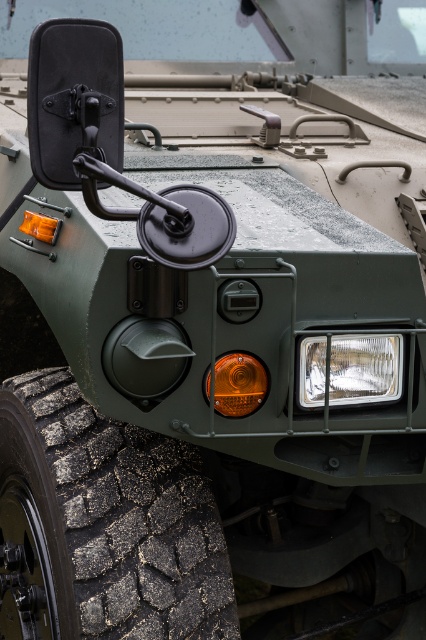
Question: Among these objects, which one is nearest to the camera?

Choices:
 (A) black rubber tire at lower left
 (B) clear plastic headlight at lower right

Answer: (B)

Question: Does black rubber tire at lower left appear over clear plastic headlight at lower right?

Choices:
 (A) no
 (B) yes

Answer: (A)

Question: Among these objects, which one is nearest to the camera?

Choices:
 (A) black rubber tire at lower left
 (B) clear plastic headlight at lower right

Answer: (B)

Question: Does black rubber tire at lower left appear over clear plastic headlight at lower right?

Choices:
 (A) yes
 (B) no

Answer: (B)

Question: Can you confirm if black rubber tire at lower left is smaller than clear plastic headlight at lower right?

Choices:
 (A) yes
 (B) no

Answer: (B)